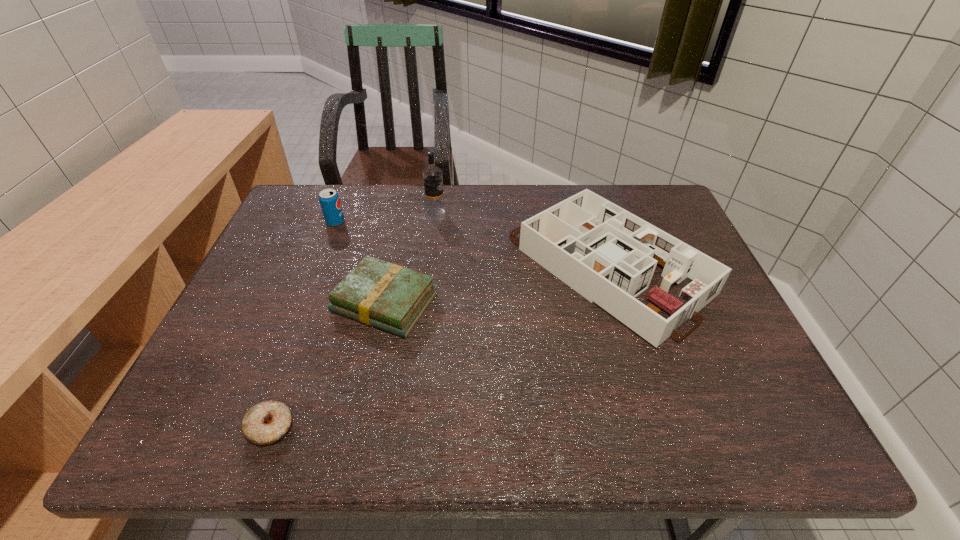
This screenshot has width=960, height=540. I want to click on object that is at the far right corner, so click(x=608, y=255).

In the image, there is a desktop. Where is `vacant space at the far edge`? The image size is (960, 540). vacant space at the far edge is located at coordinates (518, 199).

In the image, there is a desktop. At what (x,y) coordinates should I click in order to perform the action: click on free space at the near edge. Please return your answer as a coordinate pair (x, y). Image resolution: width=960 pixels, height=540 pixels. Looking at the image, I should click on (578, 433).

Locate an element on the screen. Image resolution: width=960 pixels, height=540 pixels. free point at the left edge is located at coordinates (245, 286).

Where is `vacant region at the far right corner of the desktop`? This screenshot has width=960, height=540. vacant region at the far right corner of the desktop is located at coordinates (656, 217).

The height and width of the screenshot is (540, 960). I want to click on free space between the dollhouse and the doughnut, so point(439,347).

Where is `free space between the nearest object and the vodka`? free space between the nearest object and the vodka is located at coordinates (353, 320).

At what (x,y) coordinates should I click in order to perform the action: click on free space between the dollhouse and the nearest object. Please return your answer as a coordinate pair (x, y). This screenshot has height=540, width=960. Looking at the image, I should click on (439, 347).

Find the location of a particular element. The height and width of the screenshot is (540, 960). free point between the doughnut and the tallest object is located at coordinates [353, 320].

Where is `unoccupied area between the vodka and the fourth tallest object`? The height and width of the screenshot is (540, 960). unoccupied area between the vodka and the fourth tallest object is located at coordinates (411, 258).